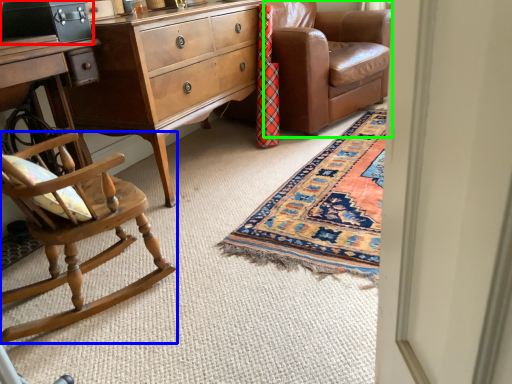
Question: Which is nearer to the cabinetry (highlighted by a red box)? chair (highlighted by a blue box) or studio couch (highlighted by a green box).

Choices:
 (A) chair
 (B) studio couch

Answer: (A)